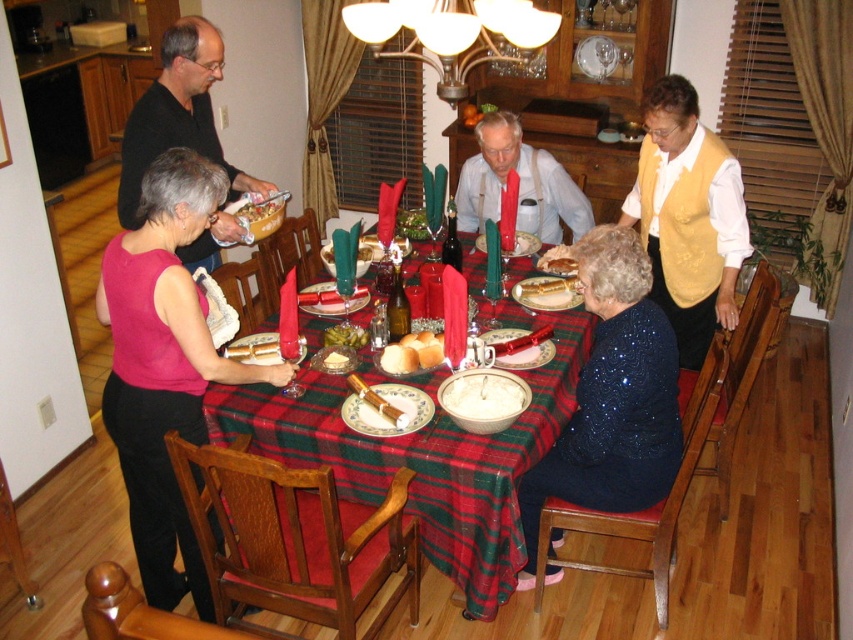
Question: Is pink fabric dress at left behind white creamy bowl at center?

Choices:
 (A) no
 (B) yes

Answer: (A)

Question: Which of the following is the farthest from the observer?

Choices:
 (A) (135, 486)
 (B) (264, 202)

Answer: (B)

Question: Is pink fabric dress at left wider than white creamy bowl at center?

Choices:
 (A) no
 (B) yes

Answer: (B)

Question: Can you confirm if plaid fabric tablecloth at center is wider than black matte shirt at upper left?

Choices:
 (A) no
 (B) yes

Answer: (B)

Question: Considering the real-world distances, which object is farthest from the white creamy bowl at center?

Choices:
 (A) yellow textured vest at upper right
 (B) black matte shirt at upper left

Answer: (B)

Question: Which point appears farthest from the camera in this image?

Choices:
 (A) (248, 177)
 (B) (407, 372)

Answer: (A)